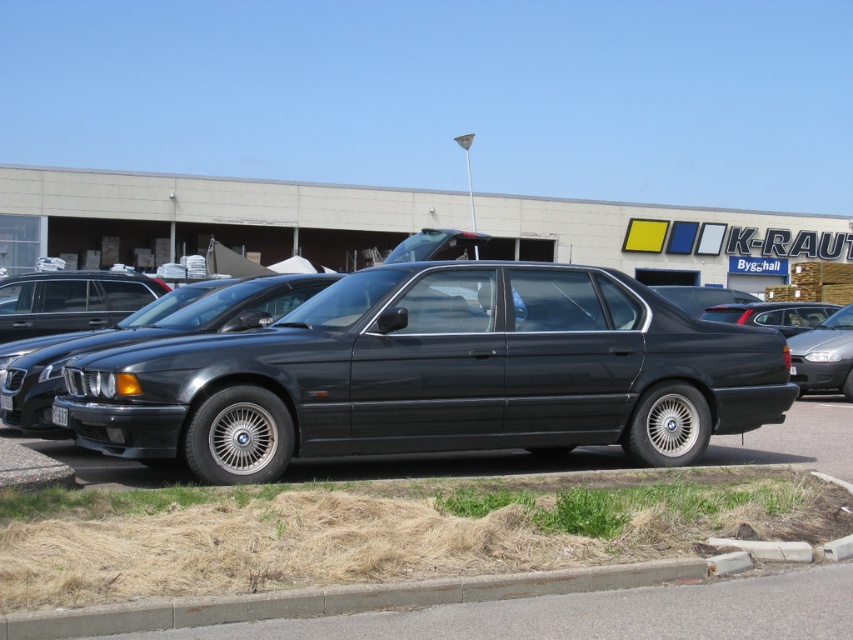
Can you confirm if glossy black sedan at center is shorter than white plastic license plate at center?

In fact, glossy black sedan at center may be taller than white plastic license plate at center.

Does point (445, 365) come in front of point (65, 412)?

No.

The image size is (853, 640). Identify the location of glossy black sedan at center. point(436,374).

From the picture: Who is lower down, satin black sedan at center or white plastic license plate at center?

→ white plastic license plate at center is lower down.

Is satin black sedan at center positioned behind white plastic license plate at center?

Yes.

Between point (798, 348) and point (54, 417), which one is positioned in front?

Point (54, 417)

I want to click on satin black sedan at center, so click(x=824, y=355).

Can you confirm if glossy black sedan at center is smaller than satin black sedan at center?

No, glossy black sedan at center is not smaller than satin black sedan at center.

Does point (292, 364) come farther from viewer compared to point (822, 384)?

No, it is not.

Between point (142, 353) and point (836, 320), which one is positioned in front?

Point (142, 353) is in front.

The width and height of the screenshot is (853, 640). What are the coordinates of `glossy black sedan at center` in the screenshot? It's located at (436, 374).